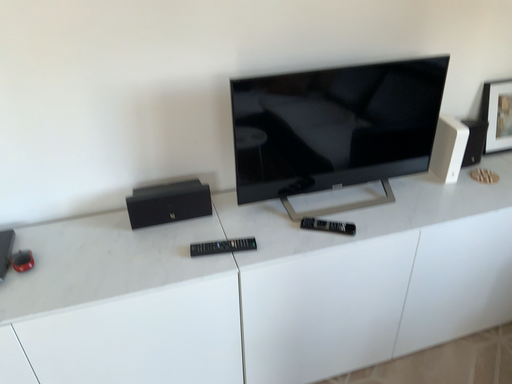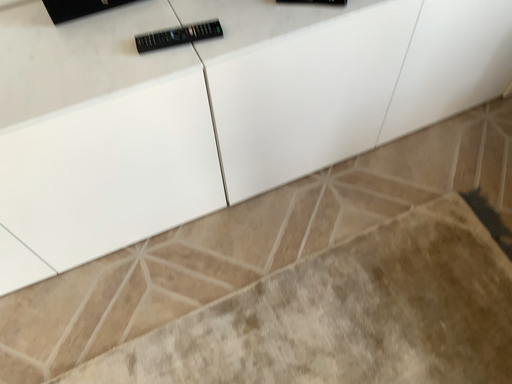
Question: Which way did the camera rotate in the video?

Choices:
 (A) rotated downward
 (B) rotated upward

Answer: (A)